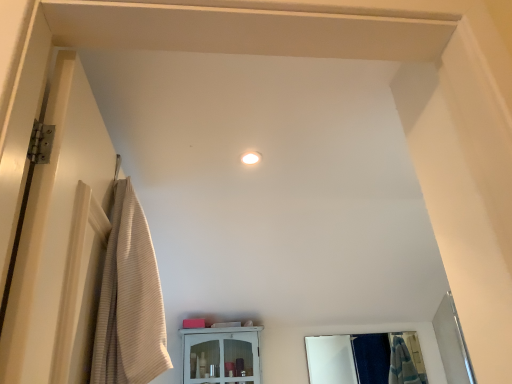
Question: Is beige ribbed towel at left completely or partially outside of clear glass mirror at center?

Choices:
 (A) no
 (B) yes

Answer: (B)

Question: Is beige ribbed towel at left aimed at clear glass mirror at center?

Choices:
 (A) no
 (B) yes

Answer: (A)

Question: From the image's perspective, would you say beige ribbed towel at left is shown under clear glass mirror at center?

Choices:
 (A) no
 (B) yes

Answer: (A)

Question: Considering the relative sizes of beige ribbed towel at left and clear glass mirror at center in the image provided, is beige ribbed towel at left smaller than clear glass mirror at center?

Choices:
 (A) no
 (B) yes

Answer: (A)

Question: From a real-world perspective, does beige ribbed towel at left stand above clear glass mirror at center?

Choices:
 (A) no
 (B) yes

Answer: (B)

Question: Based on their positions, is beige ribbed towel at left located to the left or right of white glossy cabinet at center?

Choices:
 (A) right
 (B) left

Answer: (B)

Question: Is point (114, 304) closer or farther from the camera than point (197, 360)?

Choices:
 (A) closer
 (B) farther

Answer: (A)

Question: From their relative heights in the image, would you say beige ribbed towel at left is taller or shorter than white glossy cabinet at center?

Choices:
 (A) tall
 (B) short

Answer: (A)

Question: Based on their sizes in the image, would you say beige ribbed towel at left is bigger or smaller than white glossy cabinet at center?

Choices:
 (A) big
 (B) small

Answer: (A)

Question: From a real-world perspective, is beige ribbed towel at left above or below clear glass mirror at center?

Choices:
 (A) below
 (B) above

Answer: (B)

Question: Considering the relative positions of beige ribbed towel at left and clear glass mirror at center in the image provided, is beige ribbed towel at left to the left or to the right of clear glass mirror at center?

Choices:
 (A) left
 (B) right

Answer: (A)

Question: Does point (125, 370) appear closer or farther from the camera than point (370, 370)?

Choices:
 (A) farther
 (B) closer

Answer: (B)

Question: From the image's perspective, is beige ribbed towel at left above or below clear glass mirror at center?

Choices:
 (A) above
 (B) below

Answer: (A)

Question: In the image, is clear glass mirror at center positioned in front of or behind white glossy cabinet at center?

Choices:
 (A) front
 (B) behind

Answer: (B)

Question: From the image's perspective, is clear glass mirror at center positioned above or below white glossy cabinet at center?

Choices:
 (A) above
 (B) below

Answer: (B)